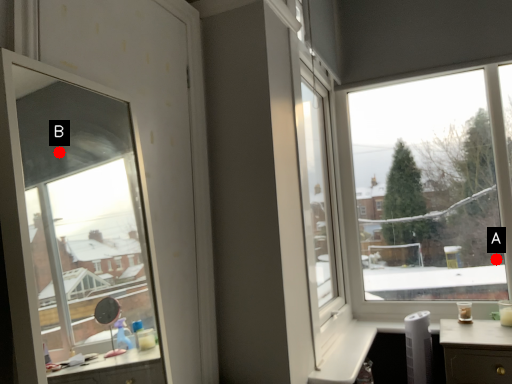
Question: Two points are circled on the image, labeled by A and B beside each circle. Which point is farther from the camera taking this photo?

Choices:
 (A) A is further
 (B) B is further

Answer: (B)